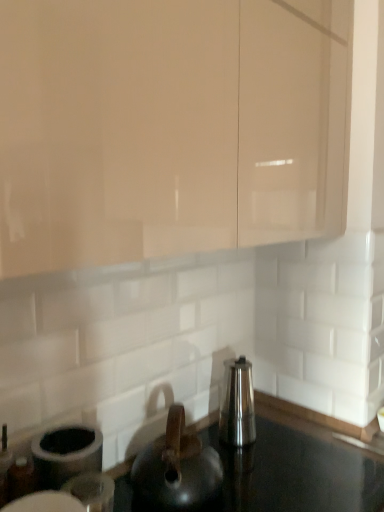
Identify the location of free spot to the right of matte black kettle at center. (272, 475).